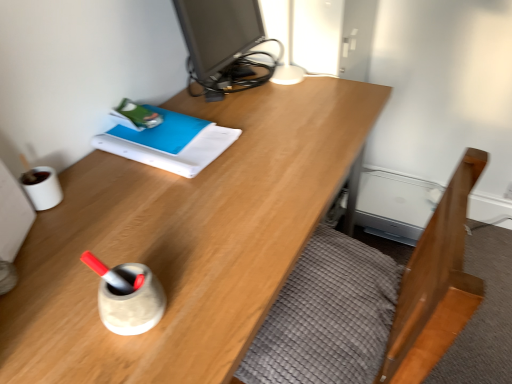
Identify the location of free space on the front side of matte black monitor at upper center. This screenshot has width=512, height=384. (272, 132).